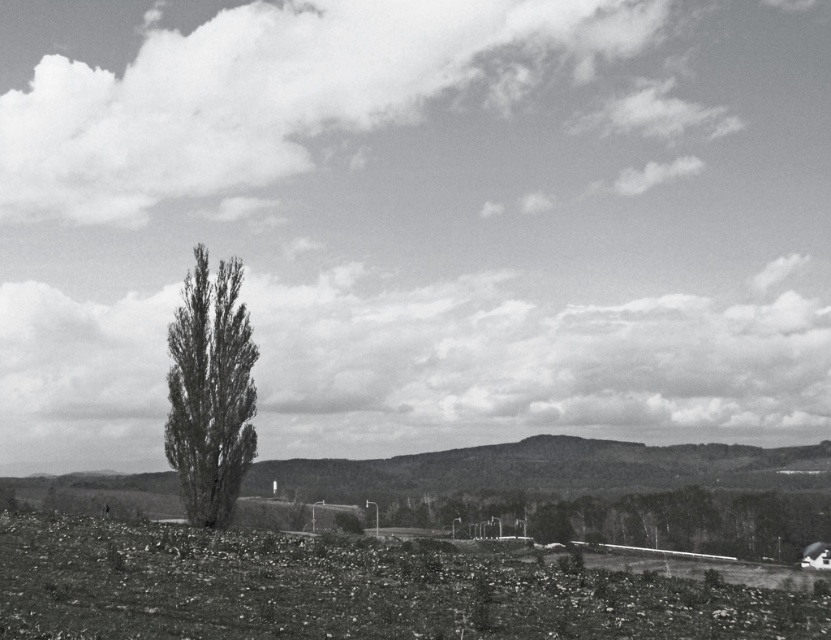
Who is more distant from viewer, (x=666, y=545) or (x=227, y=385)?

Point (x=666, y=545)

What do you see at coordinates (638, 520) in the screenshot? This screenshot has width=831, height=640. I see `smooth green tree at center` at bounding box center [638, 520].

You are a GUI agent. You are given a task and a screenshot of the screen. Output one action in this format:
    pyautogui.click(x=<x>, y=<y>)
    Task: Click on the smooth green tree at center
    
    Given the screenshot: What is the action you would take?
    pyautogui.click(x=638, y=520)

Who is lower down, gravelly soil at lower center or smooth green tree at center?

Positioned lower is smooth green tree at center.

How far apart are gravelly soil at lower center and smooth green tree at center?

gravelly soil at lower center and smooth green tree at center are 71.65 meters apart from each other.

Who is more distant from viewer, [809,605] or [630,528]?

Positioned behind is point [630,528].

Find the location of a particular element. Image resolution: width=831 pixels, height=640 pixels. gravelly soil at lower center is located at coordinates pyautogui.click(x=348, y=589).

Does gravelly soil at lower center appear on the left side of gray textured tree at center?

Incorrect, gravelly soil at lower center is not on the left side of gray textured tree at center.

Is gravelly soil at lower center positioned in front of gray textured tree at center?

Yes.

What do you see at coordinates (348, 589) in the screenshot? I see `gravelly soil at lower center` at bounding box center [348, 589].

The height and width of the screenshot is (640, 831). Find the location of `gravelly soil at lower center`. gravelly soil at lower center is located at coordinates (348, 589).